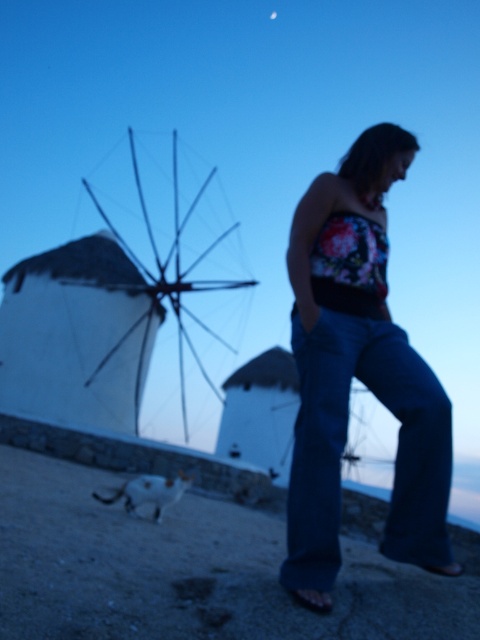
Question: Does dark blue denim jeans at center lie in front of white matte windmill at left?

Choices:
 (A) yes
 (B) no

Answer: (A)

Question: Which point is closer to the camera taking this photo?

Choices:
 (A) (347, 401)
 (B) (144, 220)

Answer: (A)

Question: Which of the following is the farthest from the observer?

Choices:
 (A) white matte windmill at left
 (B) dark blue denim jeans at center

Answer: (A)

Question: In this image, where is dark blue denim jeans at center located relative to white matte windmill at left?

Choices:
 (A) left
 (B) right

Answer: (B)

Question: Does dark blue denim jeans at center have a lesser width compared to white matte windmill at left?

Choices:
 (A) yes
 (B) no

Answer: (A)